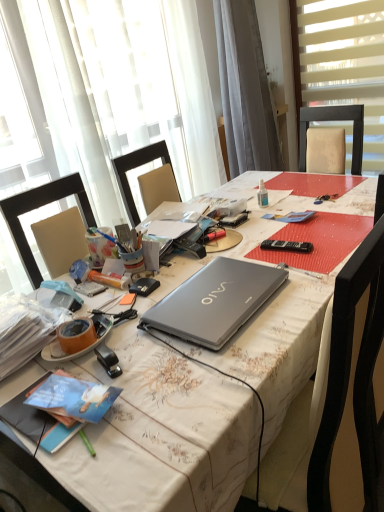
At what (x,y) coordinates should I click in order to perform the action: click on unoccupied region to the right of black plastic stapler at lower left. Please return your answer as a coordinate pair (x, y). Looking at the image, I should click on (170, 361).